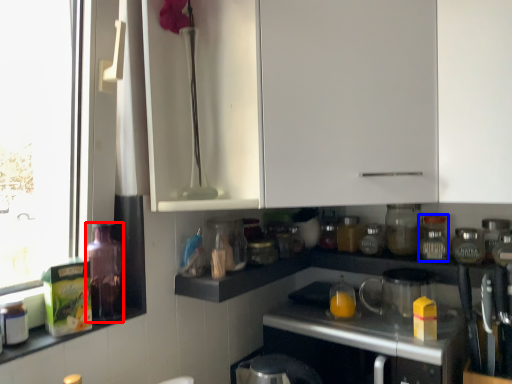
Question: Which object is further to the camera taking this photo, bottle (highlighted by a red box) or bottle (highlighted by a blue box)?

Choices:
 (A) bottle
 (B) bottle

Answer: (B)